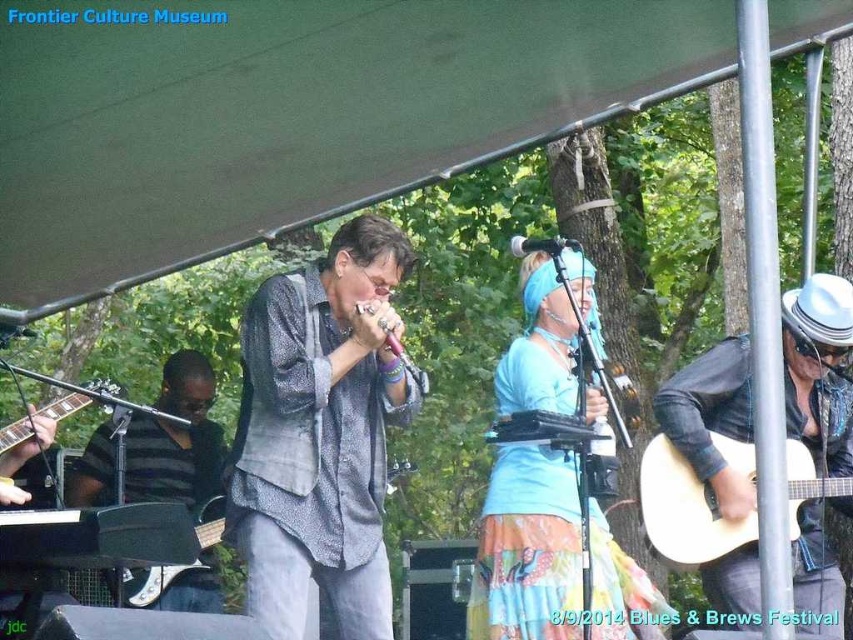
You are a photographer at the Blues and Brews Festival. You need to capture a closeup shot of the textured gray shirt at center and the black leather jacket at right. Since your camera has a limited focus area, which clothing item should you focus on first to ensure it fits within the frame?

The textured gray shirt at center is narrower than the black leather jacket at right, so you should focus on the black leather jacket at right first to ensure it fits within the frame.

You are a photographer at the Blues and Brews Festival. You want to capture a photo of the blue fabric headband at center and the black leather jacket at right in the same frame. Your camera has a minimum focus distance of 50 centimeters. Can you take the photo without moving either object?

The distance between the blue fabric headband at center and the black leather jacket at right is 47.68 centimeters, which is less than the camera minimum focus distance of 50 centimeters. Therefore, you cannot take the photo without moving either object.